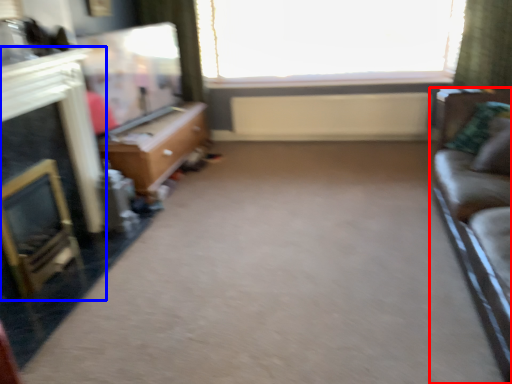
Question: Which object is further to the camera taking this photo, studio couch (highlighted by a red box) or fireplace (highlighted by a blue box)?

Choices:
 (A) studio couch
 (B) fireplace

Answer: (B)